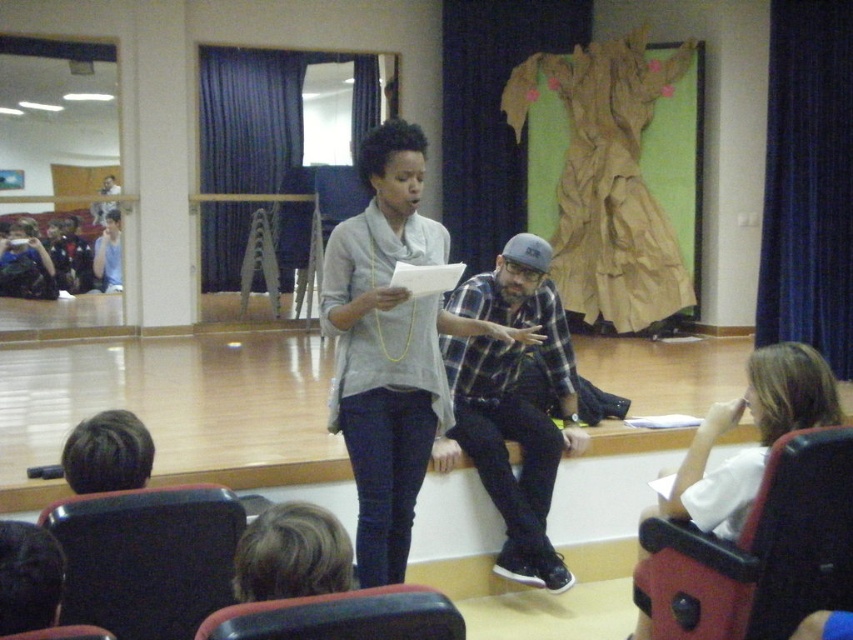
Question: Which of the following is the closest to the observer?

Choices:
 (A) (323, 259)
 (B) (775, 593)
 (C) (73, 636)

Answer: (C)

Question: Among these points, which one is nearest to the camera?

Choices:
 (A) (526, 288)
 (B) (677, 554)

Answer: (B)

Question: Can you confirm if flannel shirt at center is positioned to the right of matte black camera at left?

Choices:
 (A) no
 (B) yes

Answer: (B)

Question: Does flannel shirt at center lie behind smooth black chair at lower left?

Choices:
 (A) yes
 (B) no

Answer: (A)

Question: Considering the real-world distances, which object is closest to the black leather chair at lower right?

Choices:
 (A) matte black chair at lower left
 (B) smooth black chair at lower left
 (C) smooth black chair at lower center

Answer: (C)

Question: Is black leather chair at lower right positioned in front of smooth black chair at lower center?

Choices:
 (A) no
 (B) yes

Answer: (A)